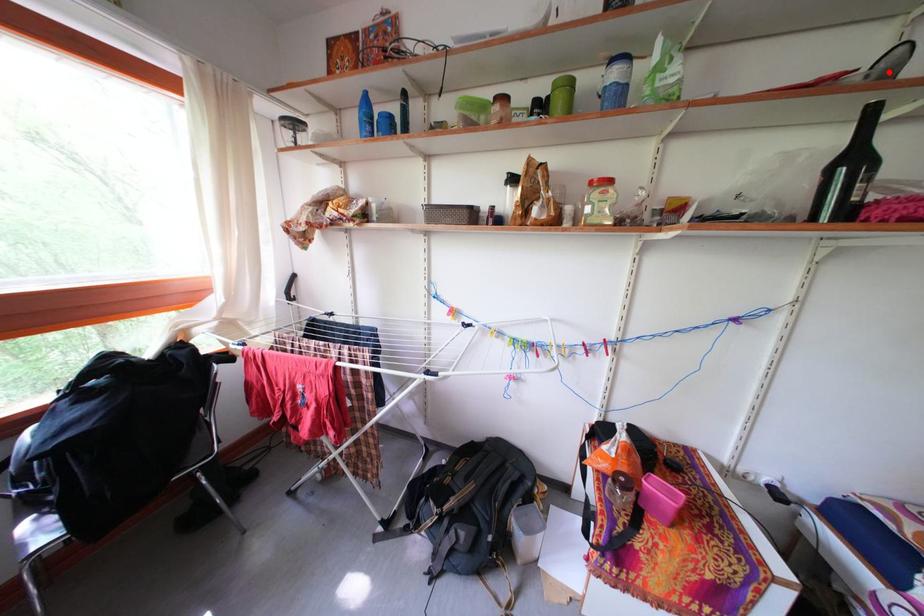
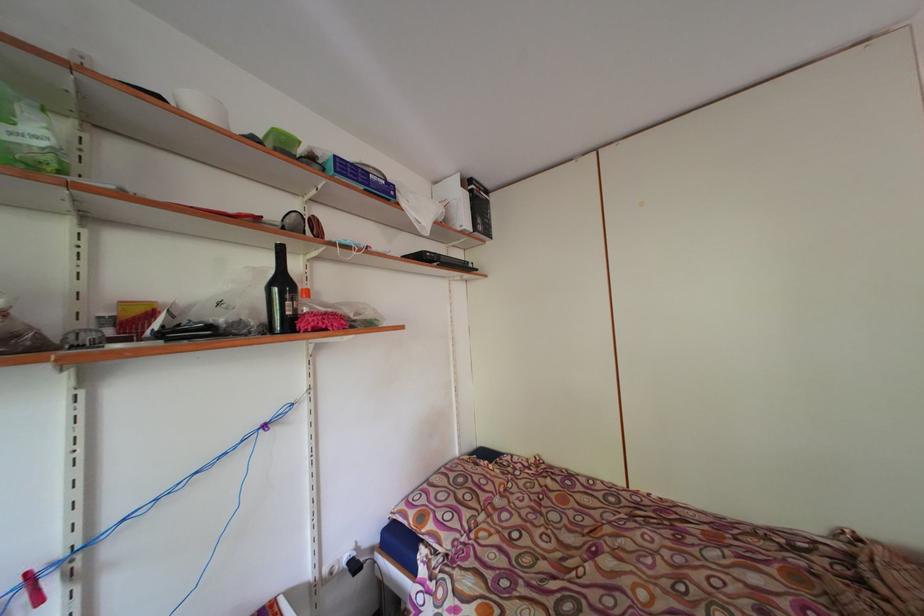
Question: I am providing you with two images of the same scene from different viewpoints. Image1 has a red point marked. In image2, the corresponding 3D location appears at what relative position? Reply with the corresponding letter.

Choices:
 (A) Closer
 (B) Farther

Answer: (A)